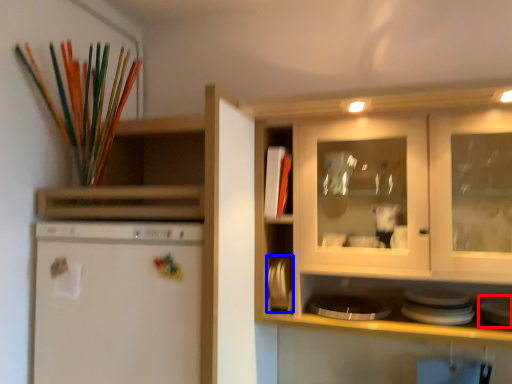
Question: Which object appears farthest to the camera in this image, appliance (highlighted by a red box) or appliance (highlighted by a blue box)?

Choices:
 (A) appliance
 (B) appliance

Answer: (B)